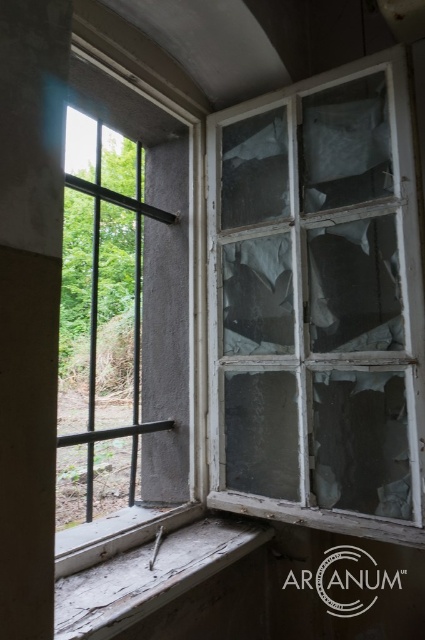
Question: Does transparent glass window at right have a larger size compared to weathered wood at lower left?

Choices:
 (A) no
 (B) yes

Answer: (B)

Question: Among these objects, which one is nearest to the camera?

Choices:
 (A) transparent glass window at center
 (B) transparent glass window at right
 (C) weathered wood at lower left

Answer: (C)

Question: Which object appears farthest from the camera in this image?

Choices:
 (A) transparent glass window at center
 (B) transparent glass window at right

Answer: (A)

Question: Is transparent glass window at right smaller than transparent glass window at center?

Choices:
 (A) no
 (B) yes

Answer: (B)

Question: Which point is farther from the camera taking this photo?

Choices:
 (A) [419, 468]
 (B) [113, 294]

Answer: (B)

Question: Is transparent glass window at right positioned in front of transparent glass window at center?

Choices:
 (A) no
 (B) yes

Answer: (B)